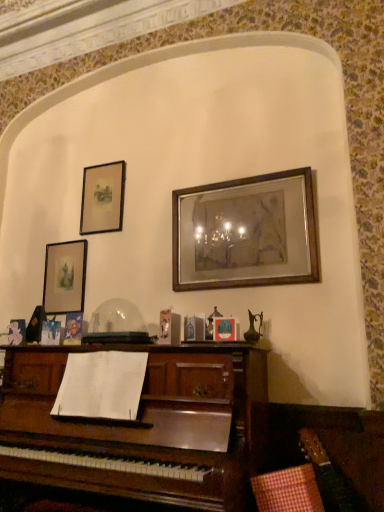
Question: Is matte gold picture frame at upper left, positioned as the first picture frame in left-to-right order, looking in the opposite direction of matte black picture frame at upper left, which ranks as the second picture frame in right-to-left order?

Choices:
 (A) no
 (B) yes

Answer: (A)

Question: Does matte gold picture frame at upper left, positioned as the 3th picture frame in right-to-left order, have a smaller size compared to matte black picture frame at upper left, the 2th picture frame when ordered from left to right?

Choices:
 (A) yes
 (B) no

Answer: (B)

Question: Can you confirm if matte gold picture frame at upper left, positioned as the first picture frame in left-to-right order, is shorter than matte black picture frame at upper left, the 2th picture frame when ordered from left to right?

Choices:
 (A) no
 (B) yes

Answer: (A)

Question: Is matte gold picture frame at upper left, positioned as the 3th picture frame in right-to-left order, at the right side of matte black picture frame at upper left, the 2th picture frame when ordered from left to right?

Choices:
 (A) no
 (B) yes

Answer: (A)

Question: Considering the relative sizes of matte gold picture frame at upper left, positioned as the first picture frame in left-to-right order, and matte black picture frame at upper left, the 2th picture frame when ordered from left to right, in the image provided, is matte gold picture frame at upper left, positioned as the first picture frame in left-to-right order, thinner than matte black picture frame at upper left, the 2th picture frame when ordered from left to right,?

Choices:
 (A) yes
 (B) no

Answer: (B)

Question: From the image's perspective, is matte black picture frame at upper left, the 2th picture frame when ordered from left to right, above or below wooden picture frame at center, placed as the 3th picture frame when sorted from left to right?

Choices:
 (A) above
 (B) below

Answer: (A)

Question: Is point (97, 201) positioned closer to the camera than point (235, 259)?

Choices:
 (A) farther
 (B) closer

Answer: (A)

Question: Which is correct: matte black picture frame at upper left, which ranks as the second picture frame in right-to-left order, is inside wooden picture frame at center, placed as the 3th picture frame when sorted from left to right, or outside of it?

Choices:
 (A) inside
 (B) outside

Answer: (B)

Question: Visually, is matte black picture frame at upper left, which ranks as the second picture frame in right-to-left order, positioned to the left or to the right of wooden picture frame at center, placed as the 3th picture frame when sorted from left to right?

Choices:
 (A) left
 (B) right

Answer: (A)

Question: Looking at their shapes, would you say wooden picture frame at center, which ranks as the first picture frame in right-to-left order, is wider or thinner than matte gold picture frame at upper left, positioned as the 3th picture frame in right-to-left order?

Choices:
 (A) wide
 (B) thin

Answer: (A)

Question: From their relative heights in the image, would you say wooden picture frame at center, placed as the 3th picture frame when sorted from left to right, is taller or shorter than matte gold picture frame at upper left, positioned as the 3th picture frame in right-to-left order?

Choices:
 (A) short
 (B) tall

Answer: (B)

Question: In the image, is wooden picture frame at center, placed as the 3th picture frame when sorted from left to right, positioned in front of or behind matte gold picture frame at upper left, positioned as the 3th picture frame in right-to-left order?

Choices:
 (A) front
 (B) behind

Answer: (A)

Question: Is point click(x=188, y=201) closer or farther from the camera than point click(x=74, y=288)?

Choices:
 (A) closer
 (B) farther

Answer: (A)

Question: Considering the positions of point (82, 245) and point (235, 248), is point (82, 245) closer or farther from the camera than point (235, 248)?

Choices:
 (A) farther
 (B) closer

Answer: (A)

Question: In terms of width, does matte gold picture frame at upper left, positioned as the 3th picture frame in right-to-left order, look wider or thinner when compared to wooden picture frame at center, placed as the 3th picture frame when sorted from left to right?

Choices:
 (A) thin
 (B) wide

Answer: (A)